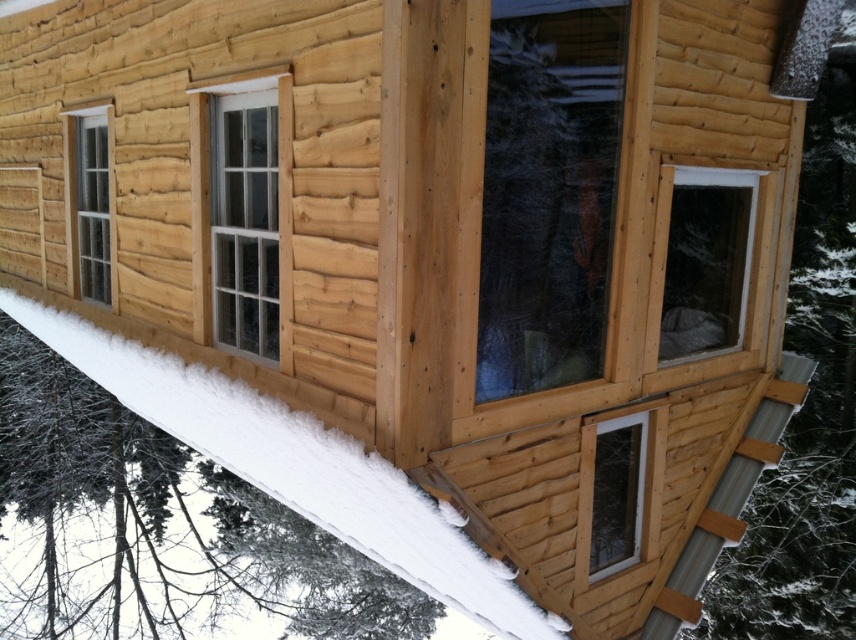
You are standing outside the wooden cabin and want to determine which window is bigger. You see the transparent glass window at center and the white plastic window at lower right. Which one is larger?

The transparent glass window at center is larger in size than the white plastic window at lower right, so the transparent glass window at center is bigger.

You are an interior designer planning to install custom shutters on both the clear glass window at center and the clear glass window at left. Which window requires wider shutters to accommodate its size?

The clear glass window at center requires wider shutters because its width is larger than the clear glass window at left.

You are standing at the camera position and want to reach point (516, 248). Is the distance less than 15 feet?

The distance between point (516, 248) and the camera is 12.87 feet, so yes, it is less than 15 feet.